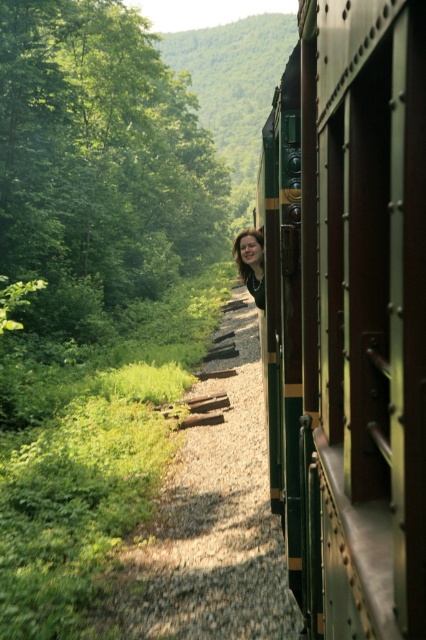
Question: Is green polished wood train at right behind blonde hair at center?

Choices:
 (A) no
 (B) yes

Answer: (A)

Question: Is green polished wood train at right wider than green leafy tree at upper left?

Choices:
 (A) yes
 (B) no

Answer: (B)

Question: Which point is closer to the camera?

Choices:
 (A) (101, 109)
 (B) (397, 310)
 (C) (247, 269)

Answer: (B)

Question: Does green polished wood train at right appear on the left side of green leafy tree at upper left?

Choices:
 (A) yes
 (B) no

Answer: (B)

Question: Which of the following is the farthest from the observer?

Choices:
 (A) (247, 250)
 (B) (408, 208)
 (C) (155, 115)

Answer: (C)

Question: Among these points, which one is farthest from the camera?

Choices:
 (A) (258, 272)
 (B) (379, 225)
 (C) (34, 184)

Answer: (C)